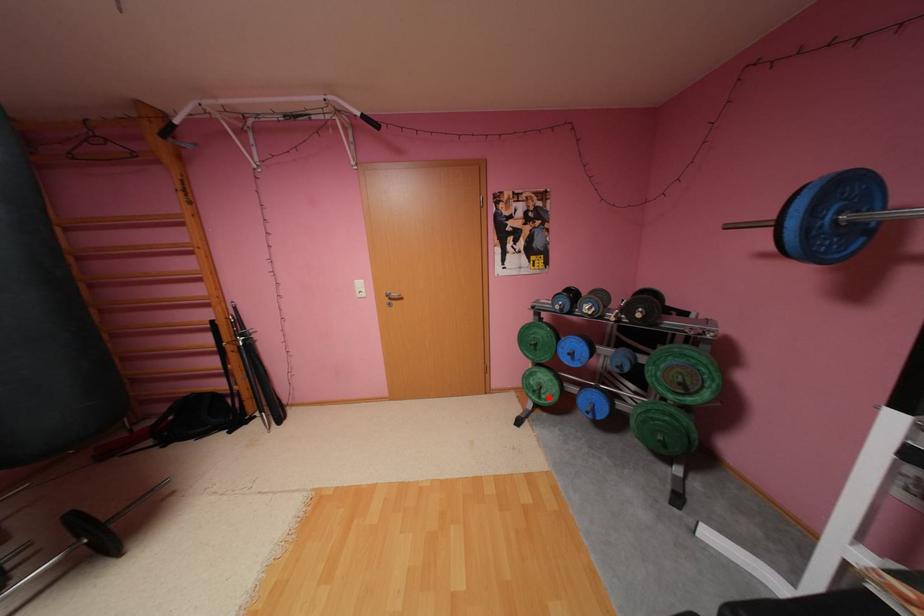
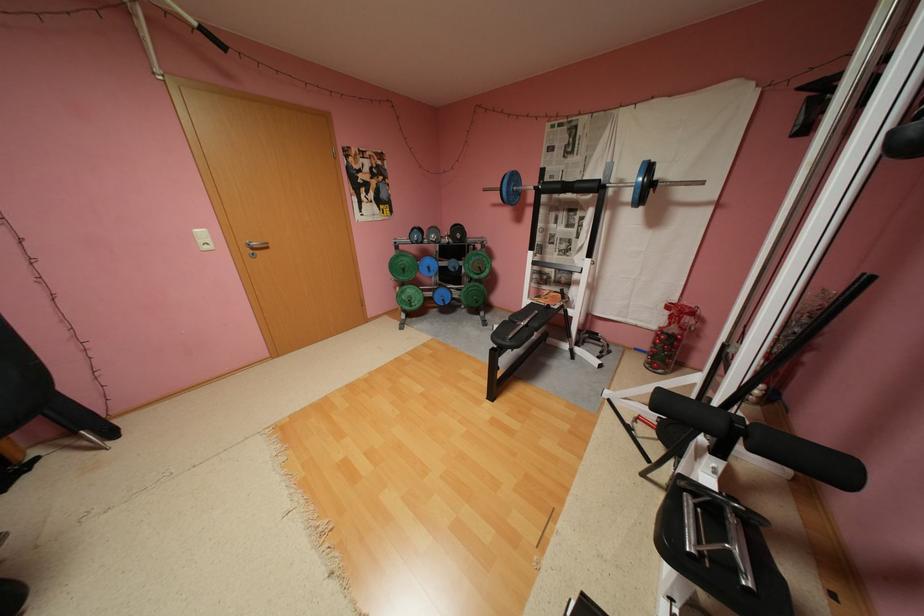
Question: A red point is marked in image1. In image2, is the corresponding 3D point closer to the camera or farther? Reply with the corresponding letter.

Choices:
 (A) The corresponding 3D point is closer.
 (B) The corresponding 3D point is farther.

Answer: (A)